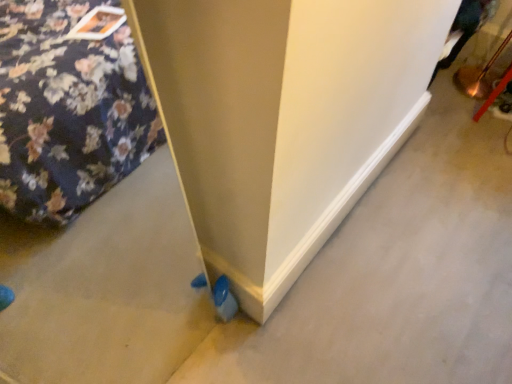
Where is `blank space to the left of blue rubber toy at lower center`? blank space to the left of blue rubber toy at lower center is located at coordinates (183, 324).